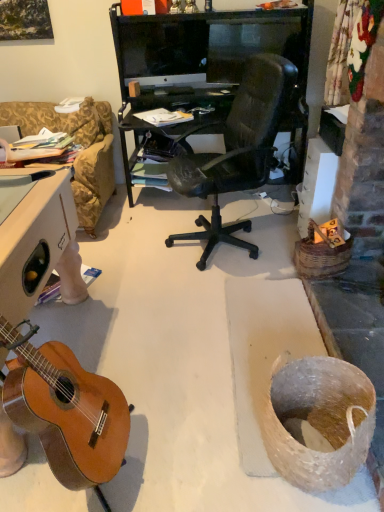
The height and width of the screenshot is (512, 384). I want to click on unoccupied space behind natural wood guitar at lower left, so [139, 369].